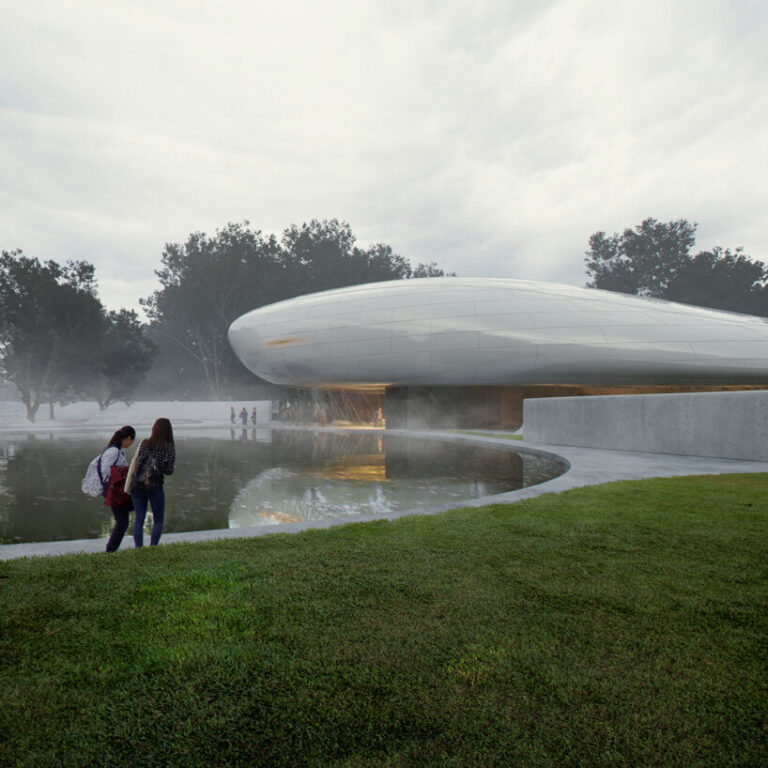
The width and height of the screenshot is (768, 768). Find the location of `areas with electric lighting`. areas with electric lighting is located at coordinates (379, 398).